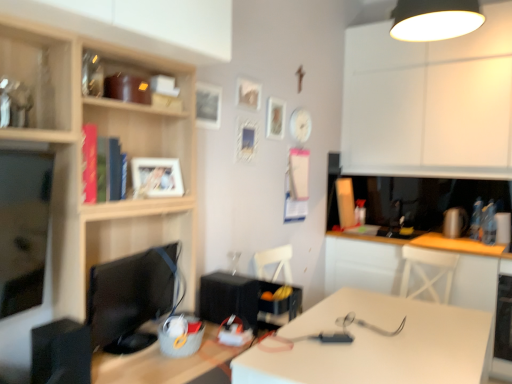
Question: Considering the relative sizes of white matte desk at center and white glossy table at lower right in the image provided, is white matte desk at center smaller than white glossy table at lower right?

Choices:
 (A) no
 (B) yes

Answer: (B)

Question: Is white matte desk at center placed right next to white glossy table at lower right?

Choices:
 (A) no
 (B) yes

Answer: (A)

Question: Is white matte desk at center bigger than white glossy table at lower right?

Choices:
 (A) no
 (B) yes

Answer: (A)

Question: From a real-world perspective, is white matte desk at center physically below white glossy table at lower right?

Choices:
 (A) yes
 (B) no

Answer: (A)

Question: From the image's perspective, is white matte desk at center below white glossy table at lower right?

Choices:
 (A) no
 (B) yes

Answer: (B)

Question: Considering their positions, is white matte cabinet at upper right, the first cabinetry when ordered from right to left, located in front of or behind white matte desk at center?

Choices:
 (A) front
 (B) behind

Answer: (B)

Question: From a real-world perspective, relative to white matte desk at center, is white matte cabinet at upper right, placed as the second cabinetry when sorted from left to right, vertically above or below?

Choices:
 (A) below
 (B) above

Answer: (B)

Question: Do you think white matte cabinet at upper right, marked as the second cabinetry in a front-to-back arrangement, is within white matte desk at center, or outside of it?

Choices:
 (A) inside
 (B) outside

Answer: (B)

Question: Is white matte cabinet at upper right, placed as the second cabinetry when sorted from left to right, wider or thinner than white matte desk at center?

Choices:
 (A) wide
 (B) thin

Answer: (B)

Question: Relative to black glossy monitor at left, is wooden photo frame at upper center, the 4th picture frame positioned from the right, in front or behind?

Choices:
 (A) behind
 (B) front

Answer: (A)

Question: From their relative heights in the image, would you say wooden photo frame at upper center, positioned as the 4th picture frame in back-to-front order, is taller or shorter than black glossy monitor at left?

Choices:
 (A) tall
 (B) short

Answer: (B)

Question: In terms of size, does wooden photo frame at upper center, the 2th picture frame positioned from the left, appear bigger or smaller than black glossy monitor at left?

Choices:
 (A) small
 (B) big

Answer: (A)

Question: Choose the correct answer: Is wooden photo frame at upper center, the 4th picture frame positioned from the right, inside black glossy monitor at left or outside it?

Choices:
 (A) inside
 (B) outside

Answer: (B)

Question: From the image's perspective, is black matte speaker at center, the 2th appliance in the left-to-right sequence, located above or below black plastic speaker at left, which is counted as the second appliance, starting from the right?

Choices:
 (A) above
 (B) below

Answer: (A)

Question: Is black matte speaker at center, which is the second appliance in front-to-back order, inside or outside of black plastic speaker at left, the 1th appliance viewed from the left?

Choices:
 (A) outside
 (B) inside

Answer: (A)